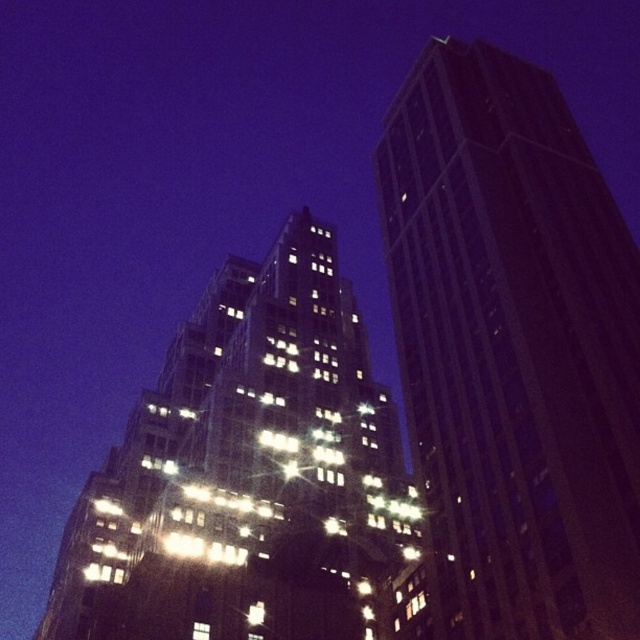
Question: Can you confirm if dark glass skyscraper at right is thinner than shiny glass building at center?

Choices:
 (A) yes
 (B) no

Answer: (A)

Question: Is dark glass skyscraper at right bigger than shiny glass building at center?

Choices:
 (A) no
 (B) yes

Answer: (A)

Question: Can you confirm if dark glass skyscraper at right is smaller than shiny glass building at center?

Choices:
 (A) no
 (B) yes

Answer: (B)

Question: Which object appears farthest from the camera in this image?

Choices:
 (A) shiny glass building at center
 (B) dark glass skyscraper at right

Answer: (A)

Question: Which point appears farthest from the camera in this image?

Choices:
 (A) (596, 568)
 (B) (182, 461)

Answer: (B)